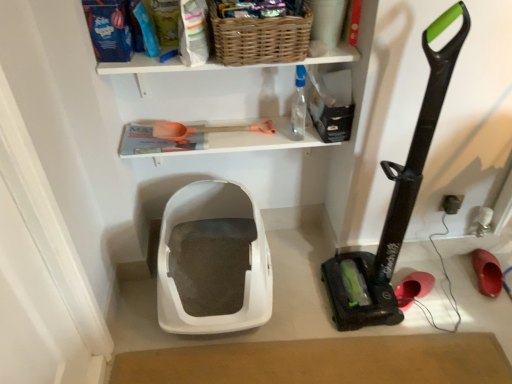
At what (x,y) coordinates should I click in order to perform the action: click on vacant space in front of rubber matte shoe at lower right, the second footwear positioned from the left. Please return your answer as a coordinate pair (x, y). Looking at the image, I should click on (489, 305).